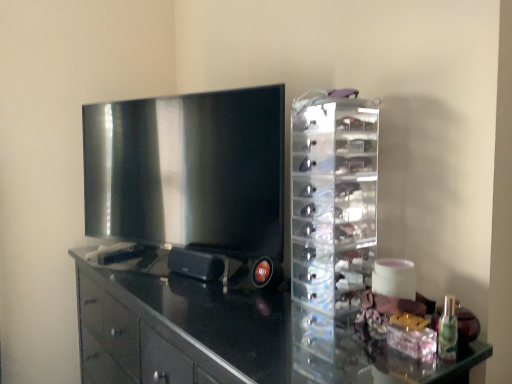
What is the approximate width of glossy black cabinet at center?

It is 21.84 inches.

Where is `transparent acrylic organizer at right`? The width and height of the screenshot is (512, 384). transparent acrylic organizer at right is located at coordinates (331, 232).

Find the location of a particular element. matte black tv at left is located at coordinates (189, 182).

The height and width of the screenshot is (384, 512). Identify the location of glossy black cabinet at center. (228, 335).

Which object is more forward, matte black tv at left or transparent acrylic organizer at right?

Positioned in front is transparent acrylic organizer at right.

Which of these two, matte black tv at left or transparent acrylic organizer at right, is wider?

Wider between the two is transparent acrylic organizer at right.

Is point (201, 235) positioned after point (302, 334)?

That is True.

From a real-world perspective, is matte black tv at left beneath transparent acrylic organizer at right?

No, from a real-world perspective, matte black tv at left is not under transparent acrylic organizer at right.

Considering the positions of objects glossy black cabinet at center and matte black tv at left in the image provided, who is in front, glossy black cabinet at center or matte black tv at left?

glossy black cabinet at center is more forward.

Are glossy black cabinet at center and matte black tv at left far apart?

Actually, glossy black cabinet at center and matte black tv at left are a little close together.

Is glossy black cabinet at center inside the boundaries of matte black tv at left, or outside?

glossy black cabinet at center cannot be found inside matte black tv at left.

Image resolution: width=512 pixels, height=384 pixels. Identify the location of cabinetry below the matte black tv at left (from a real-world perspective). (228, 335).

Is transparent acrylic organizer at right oriented towards glossy black cabinet at center?

No, transparent acrylic organizer at right is not facing towards glossy black cabinet at center.

Can you confirm if transparent acrylic organizer at right is shorter than glossy black cabinet at center?

Indeed, transparent acrylic organizer at right has a lesser height compared to glossy black cabinet at center.

The image size is (512, 384). In the image, there is a transparent acrylic organizer at right. What are the coordinates of `cabinetry below it (from a real-world perspective)` in the screenshot? It's located at (228, 335).

Is the position of transparent acrylic organizer at right more distant than that of glossy black cabinet at center?

That is True.

Locate an element on the screen. cabinetry located on the right of matte black tv at left is located at coordinates (228, 335).

Are matte black tv at left and glossy black cabinet at center beside each other?

No, matte black tv at left is not touching glossy black cabinet at center.

Is matte black tv at left positioned with its back to glossy black cabinet at center?

matte black tv at left is not turned away from glossy black cabinet at center.

Does glossy black cabinet at center lie in front of transparent acrylic organizer at right?

Yes, it is.

Find the location of `cabinetry to the left of transparent acrylic organizer at right`. cabinetry to the left of transparent acrylic organizer at right is located at coordinates (228, 335).

Is glossy black cabinet at center next to transparent acrylic organizer at right and touching it?

No, glossy black cabinet at center is not touching transparent acrylic organizer at right.

Is point (322, 228) positioned in front of point (198, 175)?

Yes.

Is transparent acrylic organizer at right at the left side of matte black tv at left?

In fact, transparent acrylic organizer at right is to the right of matte black tv at left.

Could you tell me if transparent acrylic organizer at right is turned towards matte black tv at left?

No.

Looking at this image, how different are the orientations of transparent acrylic organizer at right and matte black tv at left in degrees?

The facing directions of transparent acrylic organizer at right and matte black tv at left are 21.7 degrees apart.

Identify the location of home appliance above the transparent acrylic organizer at right (from a real-world perspective). (189, 182).

Locate an element on the screen. The image size is (512, 384). home appliance on the left side of glossy black cabinet at center is located at coordinates (189, 182).

From the image, which object appears to be nearer to transparent acrylic organizer at right, matte black tv at left or glossy black cabinet at center?

Based on the image, glossy black cabinet at center appears to be nearer to transparent acrylic organizer at right.

When comparing their distances from matte black tv at left, does transparent acrylic organizer at right or glossy black cabinet at center seem further?

transparent acrylic organizer at right is further to matte black tv at left.

Based on their spatial positions, is matte black tv at left or transparent acrylic organizer at right further from glossy black cabinet at center?

Among the two, transparent acrylic organizer at right is located further to glossy black cabinet at center.

Looking at the image, which one is located closer to matte black tv at left, glossy black cabinet at center or transparent acrylic organizer at right?

Among the two, glossy black cabinet at center is located nearer to matte black tv at left.

Based on their spatial positions, is glossy black cabinet at center or matte black tv at left closer to transparent acrylic organizer at right?

glossy black cabinet at center.

Looking at this image, looking at the image, which one is located closer to glossy black cabinet at center, transparent acrylic organizer at right or matte black tv at left?

matte black tv at left lies closer to glossy black cabinet at center than the other object.

Locate an element on the screen. This screenshot has height=384, width=512. glass box between matte black tv at left and glossy black cabinet at center vertically is located at coordinates (331, 232).